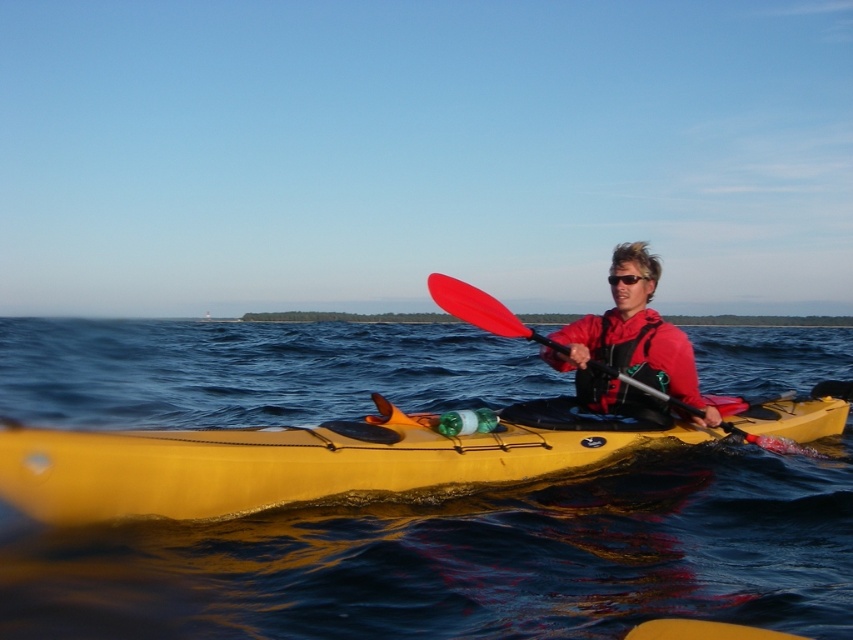
Between yellow matte kayak at center and red matte kayak at center, which one appears on the right side from the viewer's perspective?

From the viewer's perspective, red matte kayak at center appears more on the right side.

From the picture: Is yellow matte kayak at center further to camera compared to red matte kayak at center?

No, it is in front of red matte kayak at center.

Identify the location of yellow matte kayak at center. (302, 460).

Is red matte kayak at center taller than black plastic sunglasses at center?

Correct, red matte kayak at center is much taller as black plastic sunglasses at center.

What do you see at coordinates (630, 346) in the screenshot?
I see `red matte kayak at center` at bounding box center [630, 346].

The height and width of the screenshot is (640, 853). In order to click on red matte kayak at center in this screenshot , I will do `click(630, 346)`.

Find the location of `red matte kayak at center`. red matte kayak at center is located at coordinates (630, 346).

Which of these two, blue water at center or red fleece life jacket at center, stands taller?

With more height is blue water at center.

Between blue water at center and red fleece life jacket at center, which one appears on the right side from the viewer's perspective?

blue water at center

Does point (592, 518) come behind point (635, 401)?

No.

This screenshot has height=640, width=853. I want to click on blue water at center, so click(x=466, y=557).